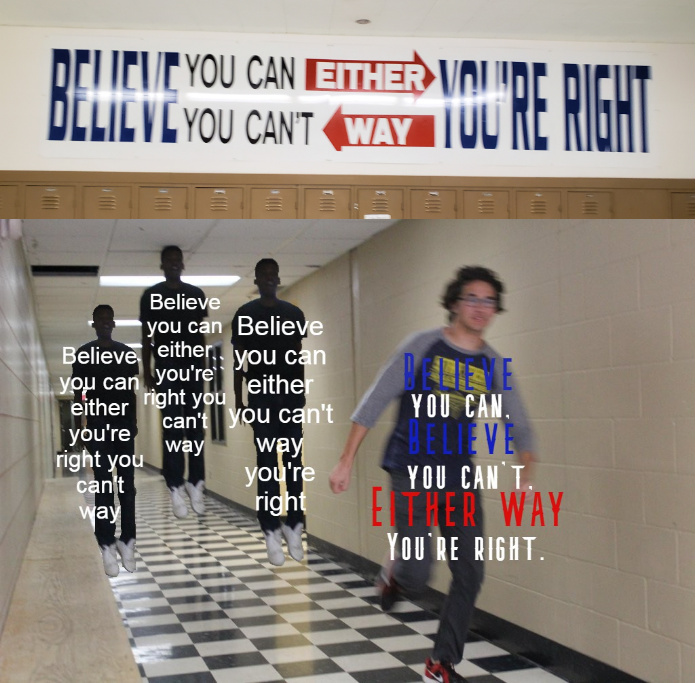
The height and width of the screenshot is (683, 696). Find the location of `missing ceiling tile`. missing ceiling tile is located at coordinates (70, 266).